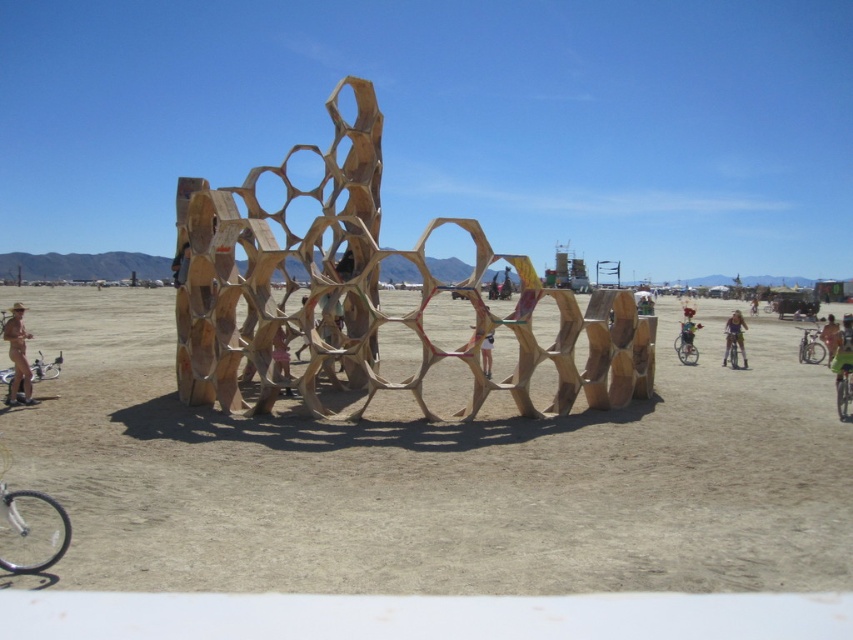
You are standing at the point with coordinates point (33, 368) and want to walk to the point with coordinates point (496, 432). Given the desert terrain, will you have to climb any obstacles between these two points?

Point (496, 432) is in front of point (33, 368), so you will not have to climb any obstacles between these two points since the desert terrain is flat.

You are standing in the desert and see two points in the scene. The first point is labeled as point (x=15, y=401) and the second is point (x=824, y=349). Which point is closer to you?

Point (x=15, y=401) is closer to the camera than point (x=824, y=349).

You are standing at the entrance of the desert area and want to find the green fabric bicycle at center. According to the coordinates provided, in which direction should you walk to locate it?

The green fabric bicycle at center is located at coordinates point (734, 337), so you should walk towards the lower right direction to locate it.